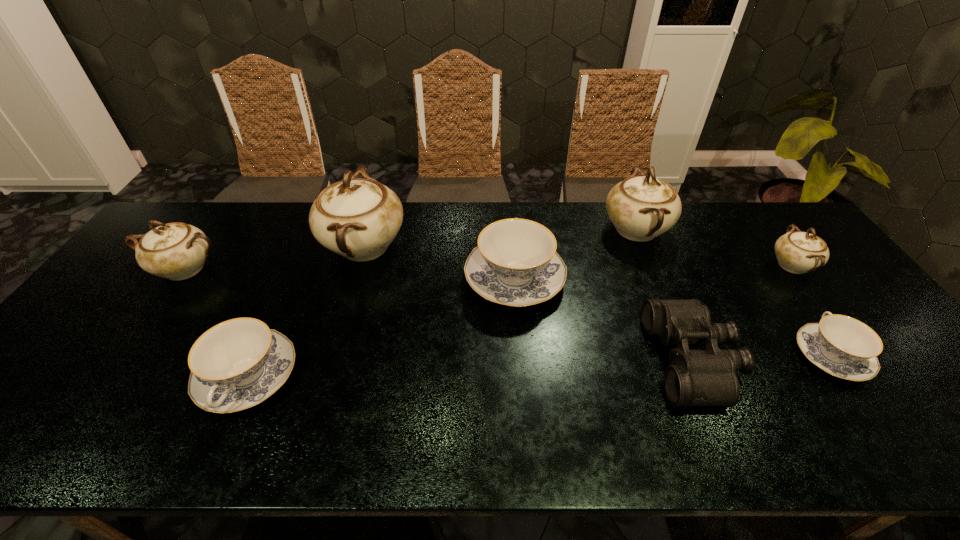
Locate an element on the screen. This screenshot has height=540, width=960. vacant space situated on the left of the rightmost white chinaware is located at coordinates (647, 266).

This screenshot has height=540, width=960. I want to click on vacant space located at the eyepieces of the black binoculars, so click(x=523, y=360).

This screenshot has width=960, height=540. Find the location of `vacant area situated 0.280m at the eyepieces of the black binoculars`. vacant area situated 0.280m at the eyepieces of the black binoculars is located at coordinates (540, 360).

Where is `vacant space situated 0.060m at the eyepieces of the black binoculars`? Image resolution: width=960 pixels, height=540 pixels. vacant space situated 0.060m at the eyepieces of the black binoculars is located at coordinates (629, 360).

Where is `free space located 0.060m with the handle on the side of the second biggest blue chinaware`? The height and width of the screenshot is (540, 960). free space located 0.060m with the handle on the side of the second biggest blue chinaware is located at coordinates (215, 451).

I want to click on vacant area situated 0.300m with the handle on the side of the smallest blue chinaware, so click(759, 253).

Identify the location of vacant space located 0.120m with the handle on the side of the smallest blue chinaware. (788, 294).

In order to click on vacant space located with the handle on the side of the smallest blue chinaware in this screenshot , I will do `click(800, 310)`.

Locate an element on the screen. The width and height of the screenshot is (960, 540). object that is at the near edge is located at coordinates (237, 364).

Locate an element on the screen. The height and width of the screenshot is (540, 960). object located at the left edge is located at coordinates (177, 251).